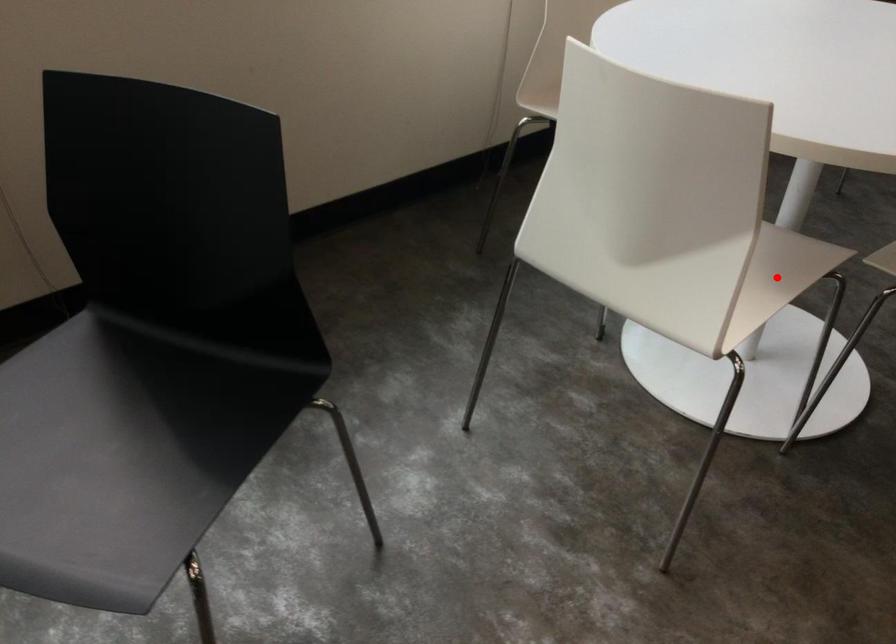
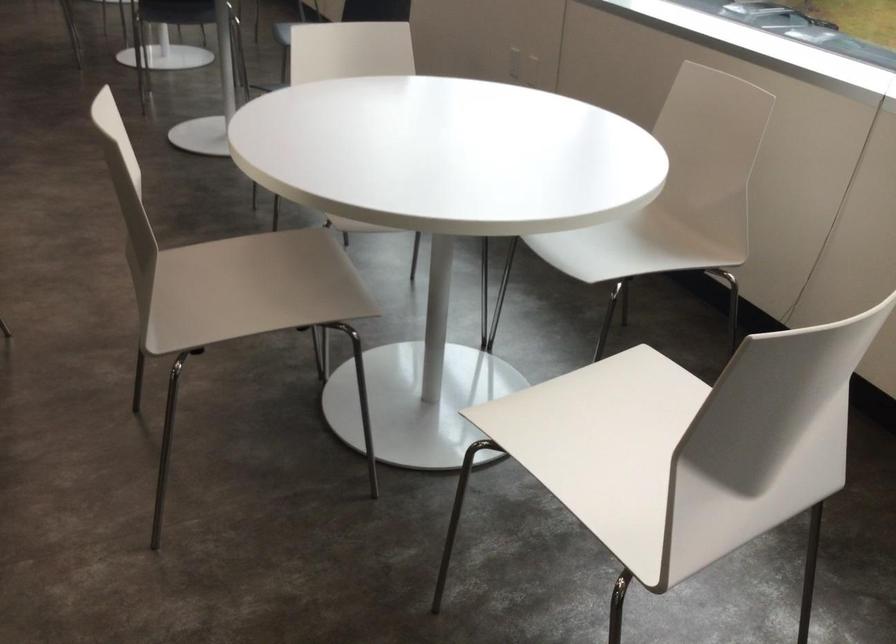
Question: I am providing you with two images of the same scene from different viewpoints. A red point is marked on the first image. Is the red point's position out of view in image 2?

Choices:
 (A) Yes
 (B) No

Answer: (A)